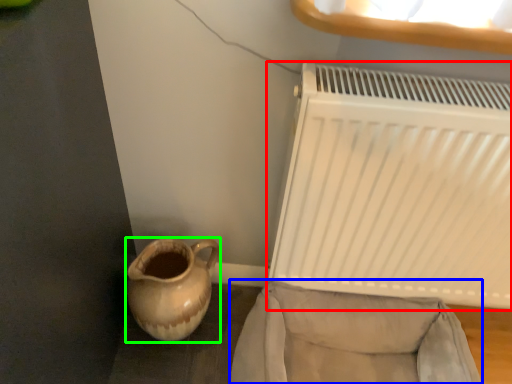
Question: Based on their relative distances, which object is farther from radiator (highlighted by a red box)? Choose from armchair (highlighted by a blue box) and jug (highlighted by a green box).

Choices:
 (A) armchair
 (B) jug

Answer: (B)